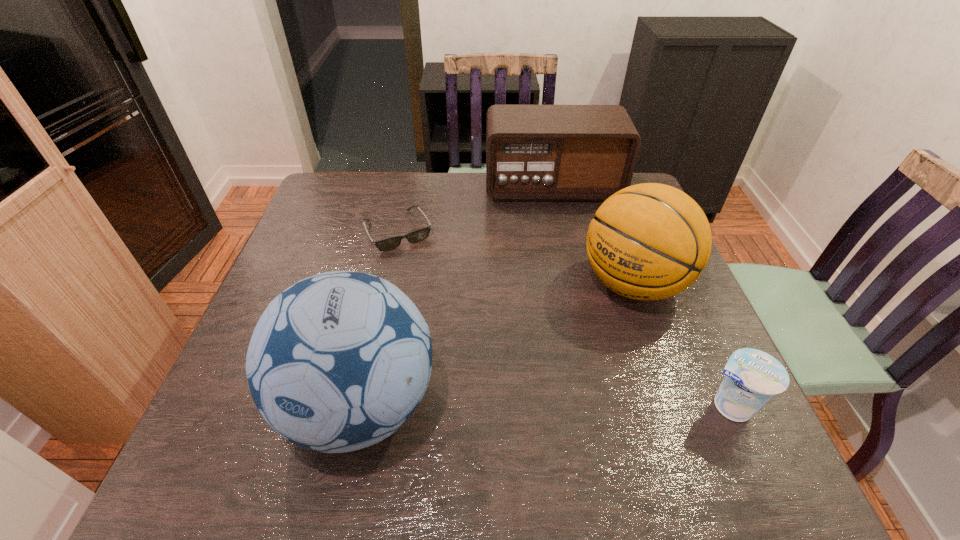
Identify the location of object at the left edge. (337, 362).

Locate an element on the screen. This screenshot has height=540, width=960. yogurt that is positioned at the right edge is located at coordinates (752, 377).

Locate an element on the screen. basketball located in the right edge section of the desktop is located at coordinates (650, 241).

Image resolution: width=960 pixels, height=540 pixels. I want to click on radio receiver that is at the right edge, so click(533, 152).

You are a GUI agent. You are given a task and a screenshot of the screen. Output one action in this format:
    pyautogui.click(x=<x>, y=<y>)
    Task: Click on the object situated at the near left corner
    This screenshot has width=960, height=540.
    Given the screenshot: What is the action you would take?
    pyautogui.click(x=337, y=362)

Locate an element on the screen. The width and height of the screenshot is (960, 540). object that is at the far right corner is located at coordinates (533, 152).

Locate an element on the screen. object that is at the near right corner is located at coordinates [x=752, y=377].

In order to click on blank space at the far edge in this screenshot , I will do `click(485, 198)`.

Where is `vacant area at the near edge`? The image size is (960, 540). vacant area at the near edge is located at coordinates (635, 411).

The image size is (960, 540). I want to click on free location at the left edge of the desktop, so click(x=309, y=217).